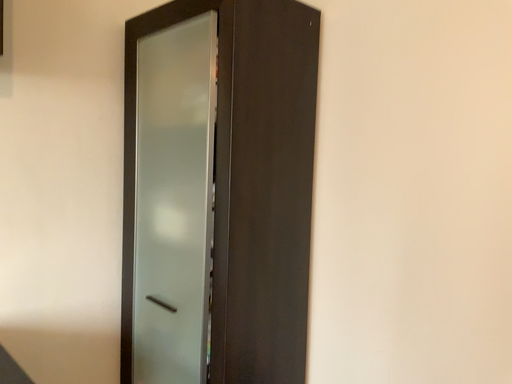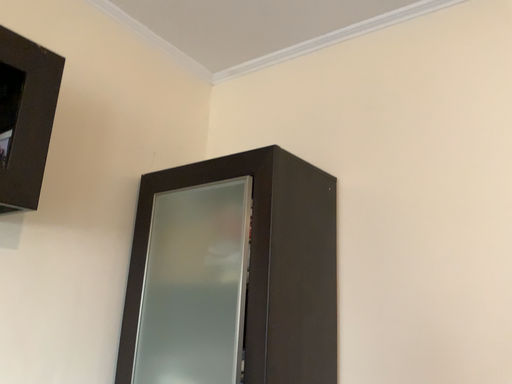
Question: Which way did the camera rotate in the video?

Choices:
 (A) rotated upward
 (B) rotated downward

Answer: (A)